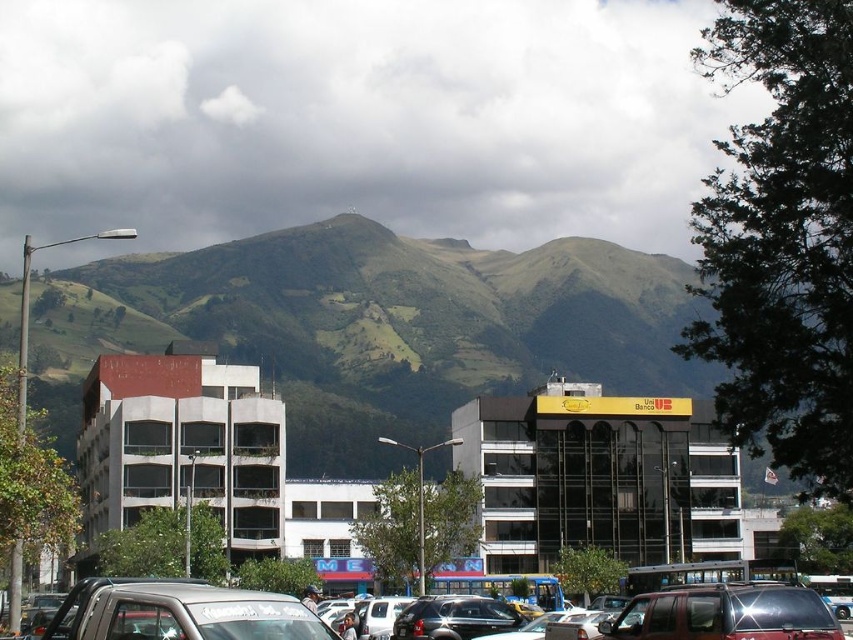
Question: Among these objects, which one is farthest from the camera?

Choices:
 (A) silver metallic suv at lower center
 (B) silver metallic pickup truck at lower left

Answer: (A)

Question: Can you confirm if green grassy mountain at upper center is positioned to the right of silver metallic pickup truck at lower left?

Choices:
 (A) yes
 (B) no

Answer: (A)

Question: Does metallic silver suv at center lie in front of shiny black car at center?

Choices:
 (A) yes
 (B) no

Answer: (A)

Question: Can you confirm if silver metallic pickup truck at lower left is wider than metallic silver suv at center?

Choices:
 (A) yes
 (B) no

Answer: (A)

Question: Which object appears closest to the camera in this image?

Choices:
 (A) green grassy mountain at upper center
 (B) silver metallic pickup truck at lower left
 (C) silver metallic suv at lower center
 (D) metallic silver suv at center

Answer: (B)

Question: Which point appears farthest from the camera in this image?

Choices:
 (A) (202, 612)
 (B) (115, 582)
 (C) (438, 637)

Answer: (C)